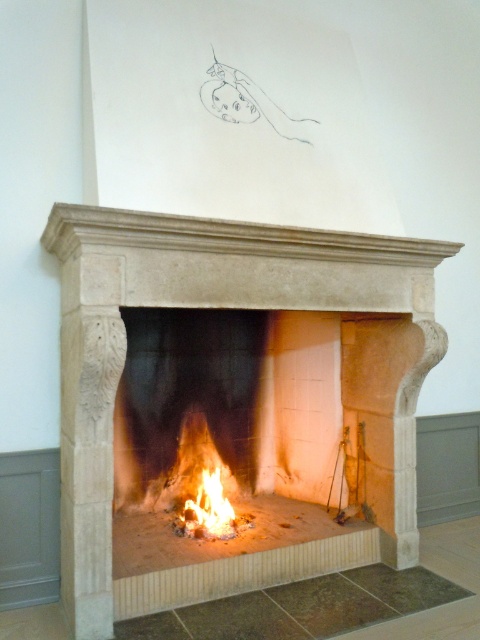
Who is more forward, (274, 296) or (208, 476)?

Positioned in front is point (274, 296).

Which is more to the right, beige stone fireplace at center or flaming wood at center?

beige stone fireplace at center

Between point (436, 330) and point (175, 525), which one is positioned behind?

The point (175, 525) is behind.

Identify the location of beige stone fireplace at center. (207, 307).

Is beige stone fireplace at center shorter than flameflame at center?

In fact, beige stone fireplace at center may be taller than flameflame at center.

Can you confirm if beige stone fireplace at center is positioned below flameflame at center?

No, beige stone fireplace at center is not below flameflame at center.

Is point (304, 282) farther from camera compared to point (194, 513)?

That is False.

The height and width of the screenshot is (640, 480). Find the location of `beige stone fireplace at center`. beige stone fireplace at center is located at coordinates (207, 307).

Who is shorter, flaming wood at center or flameflame at center?

flameflame at center is shorter.

Who is taller, flaming wood at center or flameflame at center?

flaming wood at center is taller.

This screenshot has width=480, height=640. In order to click on flaming wood at center in this screenshot , I will do `click(201, 484)`.

I want to click on flaming wood at center, so click(x=201, y=484).